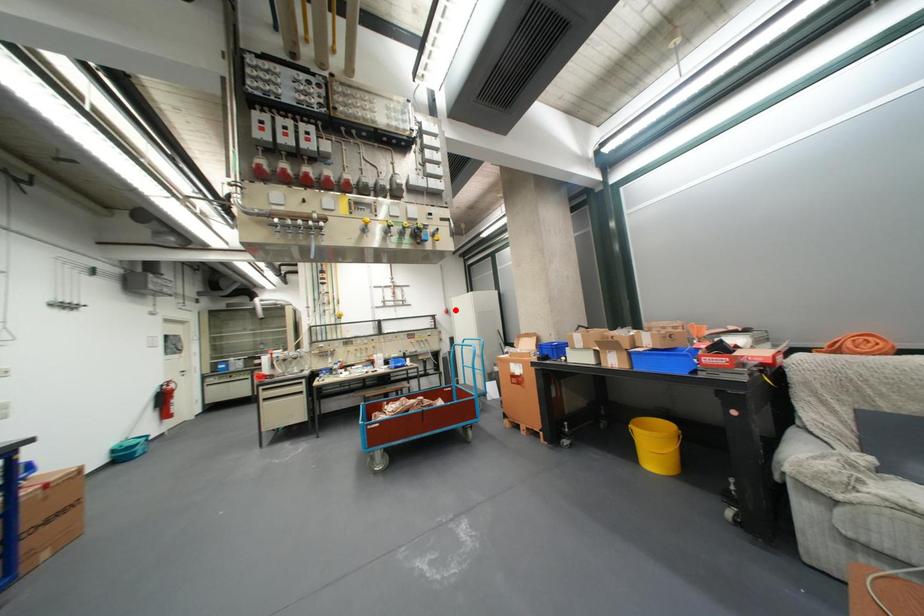
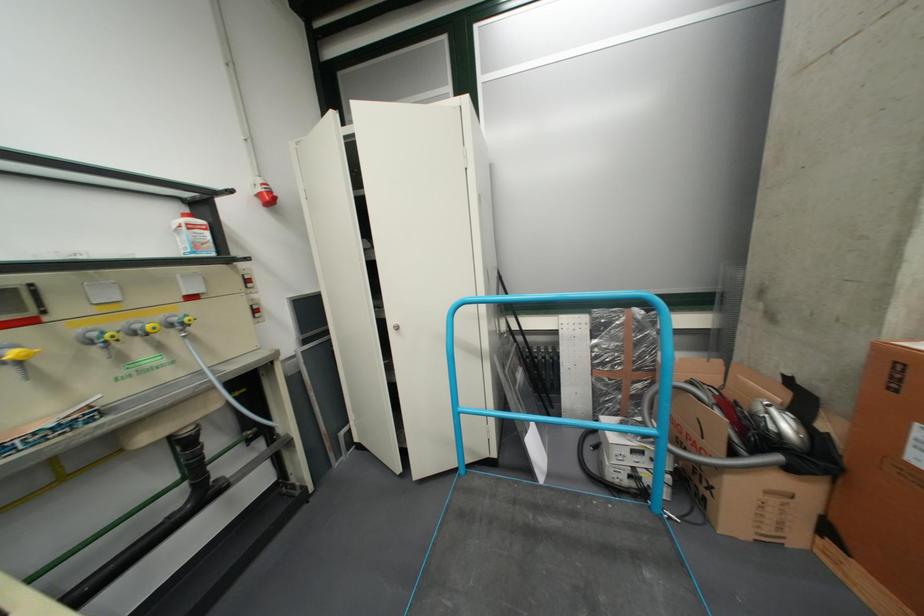
Question: I am providing you with two images of the same scene from different viewpoints. A red point is marked on the first image. Is the red point's position out of view in image 2?

Choices:
 (A) Yes
 (B) No

Answer: (B)